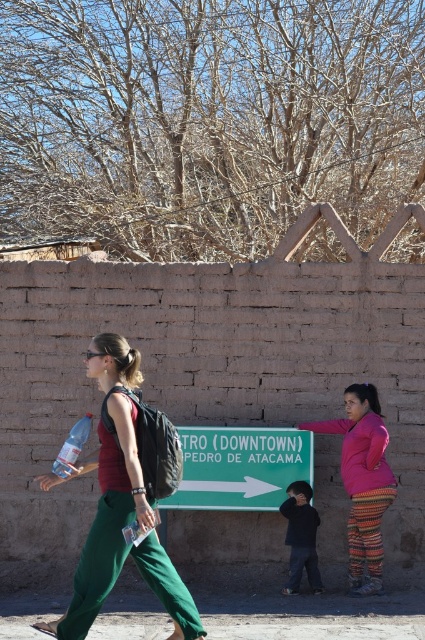
Can you confirm if matte red shirt at center is taller than green plastic sign at center?

Yes.

Is point (105, 529) in front of point (274, 468)?

Yes, it is in front of point (274, 468).

Between point (153, 563) and point (189, 458), which one is positioned behind?

Positioned behind is point (189, 458).

Identify the location of matte red shirt at center. This screenshot has height=640, width=425. point(121,536).

Is point (136, 508) closer to camera compared to point (306, 532)?

Yes, point (136, 508) is in front of point (306, 532).

Can you confirm if matte red shirt at center is positioned below dark blue sweater at center?

No, matte red shirt at center is not below dark blue sweater at center.

Which is behind, point (81, 568) or point (299, 515)?

Positioned behind is point (299, 515).

This screenshot has width=425, height=640. In order to click on matte red shirt at center in this screenshot , I will do `click(121, 536)`.

Is green plastic sign at center to the left of pink knitted sweater at right from the viewer's perspective?

Yes, green plastic sign at center is to the left of pink knitted sweater at right.

Who is more distant from viewer, (295,454) or (342,428)?

Positioned behind is point (295,454).

Find the location of `green plastic sign at center`. green plastic sign at center is located at coordinates (240, 467).